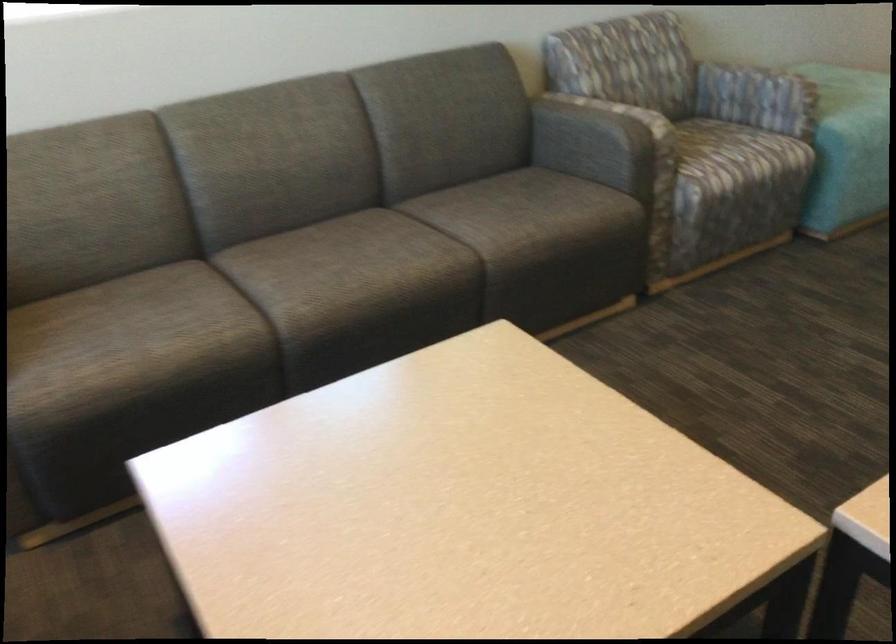
You are a GUI agent. You are given a task and a screenshot of the screen. Output one action in this format:
    pyautogui.click(x=<x>, y=<y>)
    Task: Click on the patterned chair sitting surface
    
    Given the screenshot: What is the action you would take?
    pyautogui.click(x=737, y=155)